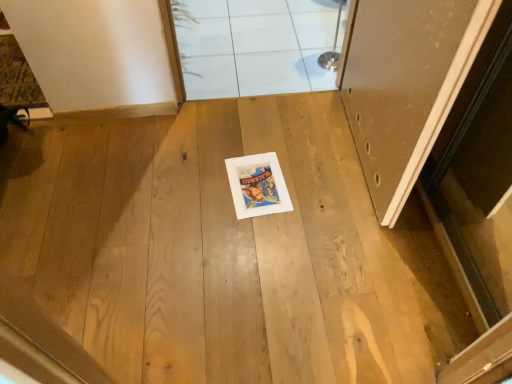
Locate an element on the screen. This screenshot has height=384, width=512. free space in front of matte white door at right is located at coordinates pos(357,259).